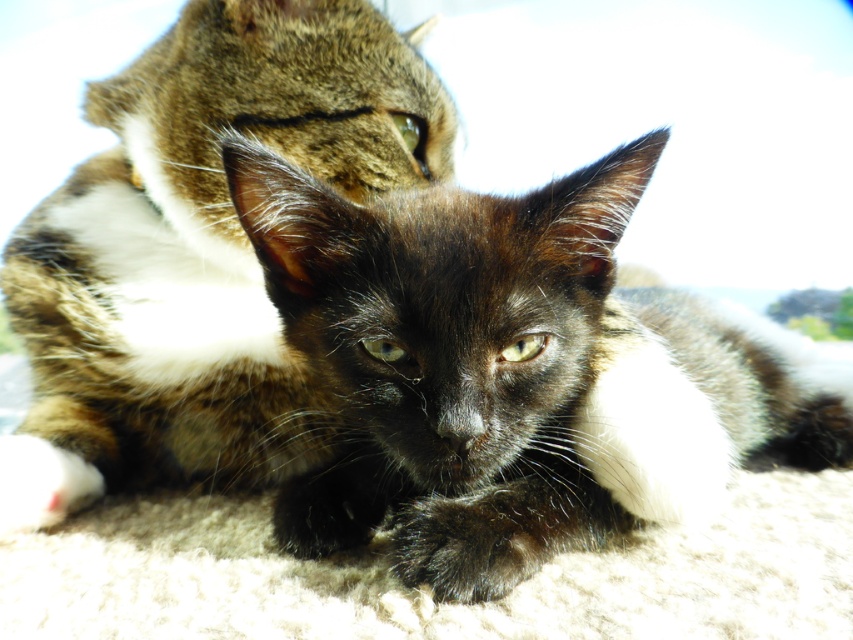
You are a photographer trying to capture the two cats in the scene. The black glossy fur cat at center and the black fur cat at center are both in your frame. Which cat should you focus on to ensure the one closer to you is sharp?

The black glossy fur cat at center is below the black fur cat at center, so focusing on the black glossy fur cat at center will ensure the closer cat is sharp.

You are standing in front of the image and want to know how far the point at coordinate (x=527, y=472) is from you. Can you determine the distance?

The distance between point (x=527, y=472) and the viewer is 3.49 feet.

You are a cat owner who wants to buy a new collar for both cats. The collar size must be adjusted to the cat size. Which cat, the black glossy fur cat at center or the black fur cat at center, requires a larger collar?

The black glossy fur cat at center requires a larger collar since it has a larger size compared to the black fur cat at center.